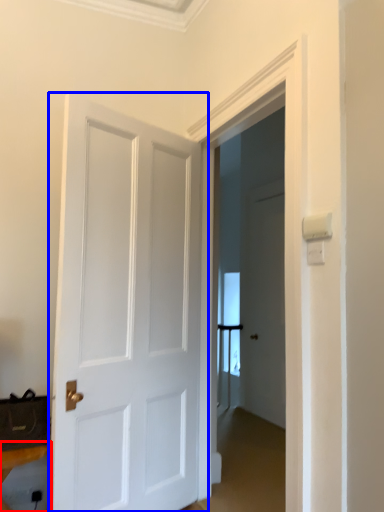
Question: Which point is closer to the camera, furniture (highlighted by a red box) or door (highlighted by a blue box)?

Choices:
 (A) furniture
 (B) door

Answer: (A)